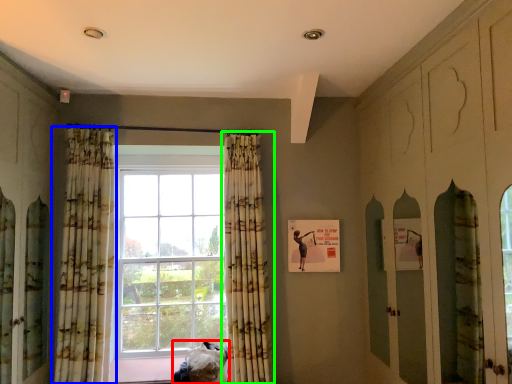
Question: Which is nearer to the furniture (highlighted by a red box)? curtain (highlighted by a blue box) or curtain (highlighted by a green box).

Choices:
 (A) curtain
 (B) curtain

Answer: (B)